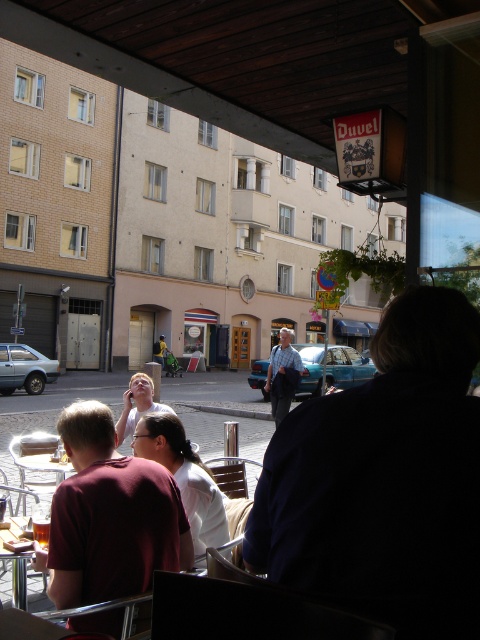
You are a customer at the outdoor cafe and want to sit at the wooden table at lower left. However, there is a person wearing a maroon shirt at center blocking your path. Can you walk around them to reach the table?

The maroon shirt at center is in front of the wooden table at lower left, so you would need to navigate around them to access the table.

You are a photographer standing at the edge of the street, wanting to capture both the dark blue shirt at center and the light blue shirt at center in a single photo. Given that your camera has a maximum focus range of 10 meters, will both subjects be within the focus range?

The distance between the dark blue shirt at center and light blue shirt at center is 8.73 meters, which is within the camera maximum focus range of 10 meters, so both subjects will be in focus.

You are a photographer trying to capture a group photo of the people at the table. You notice two individuals wearing a dark blue shirt at center and a maroon shirt at center. Based on their positions, which shirt might block the view of the other when framing the shot?

The dark blue shirt at center might block the view of the maroon shirt at center since it is wider, potentially obscuring part of the maroon shirt when positioned closer to the camera.